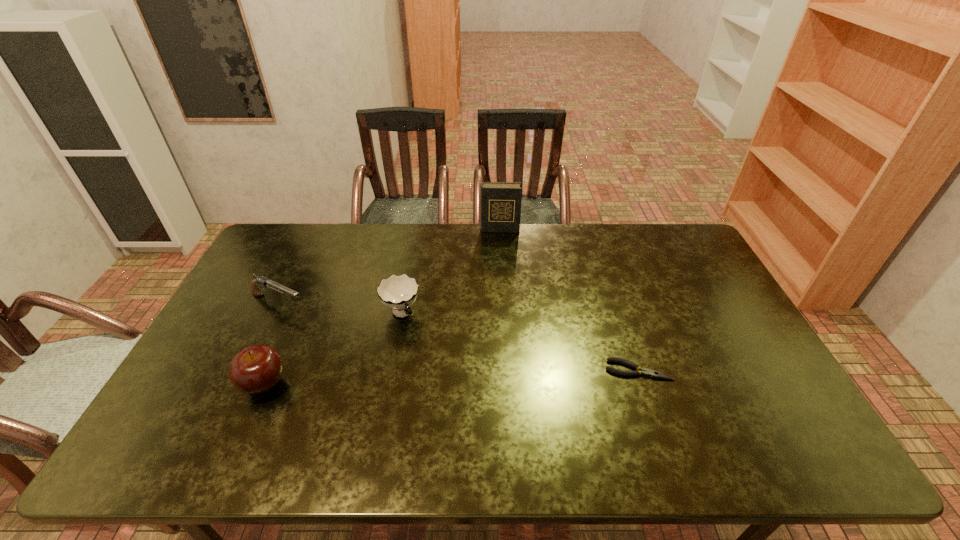
What are the coordinates of `vacant space at the near right corner` in the screenshot? It's located at (739, 416).

Where is `blank region between the rightmost object and the second object from right to left`? The image size is (960, 540). blank region between the rightmost object and the second object from right to left is located at coordinates (569, 300).

Where is `free space between the gun and the shortest object`? free space between the gun and the shortest object is located at coordinates (459, 337).

The image size is (960, 540). I want to click on vacant space in between the shortest object and the apple, so click(x=451, y=377).

Locate an element on the screen. This screenshot has height=540, width=960. free spot between the shortest object and the tallest object is located at coordinates (569, 300).

The width and height of the screenshot is (960, 540). Find the location of `free point between the gun and the third object from right to left`. free point between the gun and the third object from right to left is located at coordinates (340, 309).

In order to click on empty space between the third object from left to right and the pliers in this screenshot , I will do `click(519, 342)`.

The width and height of the screenshot is (960, 540). Find the location of `free spot between the apple and the farthest object`. free spot between the apple and the farthest object is located at coordinates (382, 307).

Find the location of `free point between the shortest object and the farthest object`. free point between the shortest object and the farthest object is located at coordinates (569, 300).

Where is `blank region between the gun and the third object from left to right`? blank region between the gun and the third object from left to right is located at coordinates (340, 309).